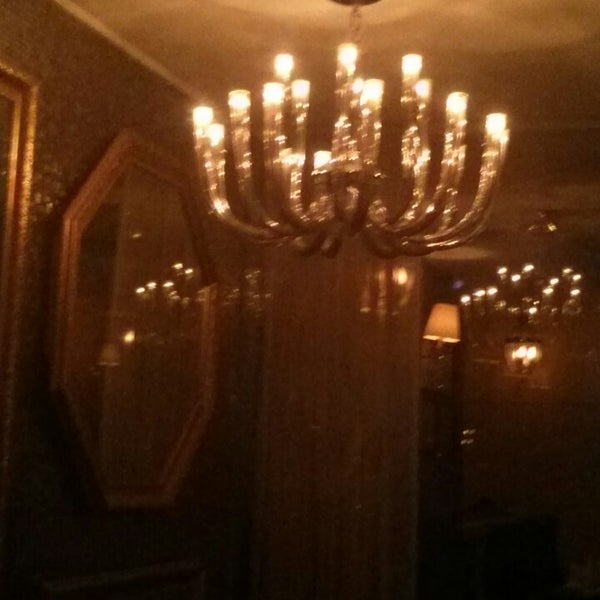
The image size is (600, 600). What are the coordinates of `ceiling` in the screenshot? It's located at (253, 27).